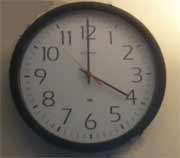
Where is `wall with light shining on iy`? The width and height of the screenshot is (180, 158). wall with light shining on iy is located at coordinates (167, 25).